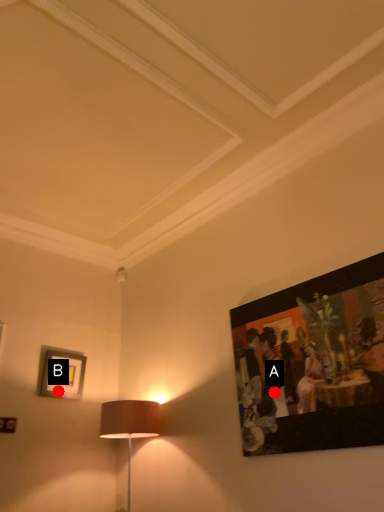
Question: Two points are circled on the image, labeled by A and B beside each circle. Which point is closer to the camera taking this photo?

Choices:
 (A) A is closer
 (B) B is closer

Answer: (A)